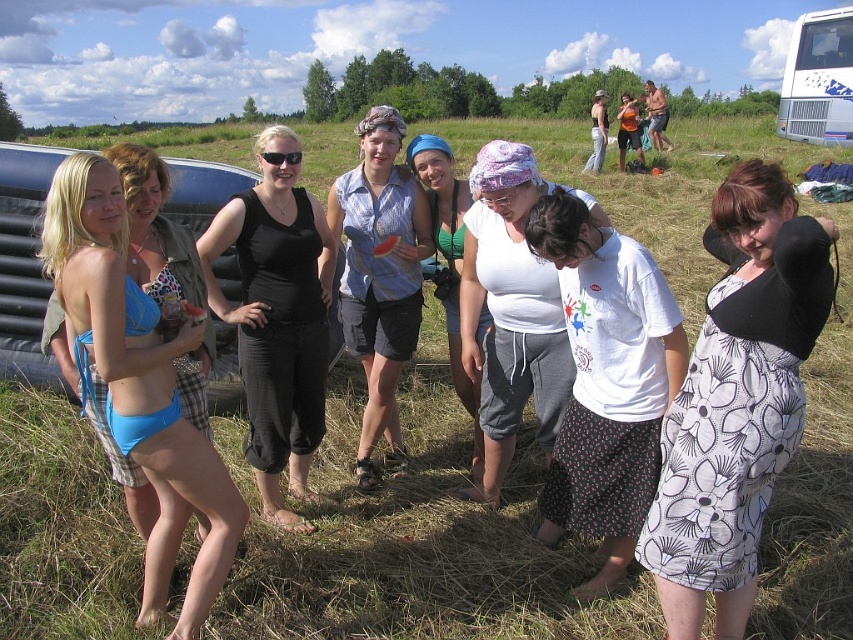
You are a photographer trying to capture a group photo of the people in the scene. You notice two individuals wearing white tops at the center of the group. Which of the two, the white printed shirt at center or the white cotton tank top at center, should you position slightly to the side to avoid overcrowding the center, considering their sizes?

The white printed shirt at center is wider than the white cotton tank top at center, so you should position the white printed shirt at center slightly to the side to avoid overcrowding the center.

In the scene shown: You are a photographer taking a picture of the group. You want to ensure that both the blue fabric bikini bottom at left and the white cotton tank top at center are clearly visible in the frame. Based on their positions, which one is lower in the image?

The blue fabric bikini bottom at left is below the white cotton tank top at center, so it is lower in the image.